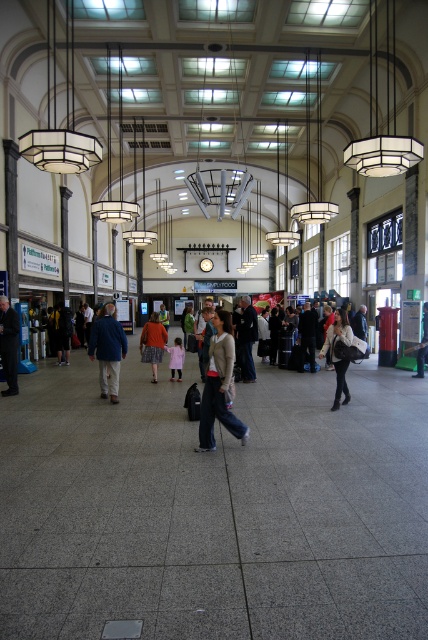
Question: Does matte beige sweater at center have a lesser width compared to dark blue jeans at center?

Choices:
 (A) yes
 (B) no

Answer: (B)

Question: Based on their relative distances, which object is nearer to the dark blue suit at left?

Choices:
 (A) matte beige sweater at center
 (B) dark blue jeans at center
 (C) matte black jacket at center

Answer: (B)

Question: Observing the image, what is the correct spatial positioning of dark blue suit at left in reference to light brown leather jacket at center?

Choices:
 (A) below
 (B) above

Answer: (B)

Question: Estimate the real-world distances between objects in this image. Which object is closer to the dark brown leather jacket at center?

Choices:
 (A) light brown leather jacket at center
 (B) dark blue jeans at center
 (C) dark blue suit at left

Answer: (C)

Question: Which of these objects is positioned farthest from the dark brown leather jacket at center?

Choices:
 (A) dark blue jeans at center
 (B) matte red jacket at center
 (C) blue fabric jacket at center
 (D) matte beige sweater at center

Answer: (D)

Question: Does dark blue suit at left have a smaller size compared to light brown leather jacket at center?

Choices:
 (A) no
 (B) yes

Answer: (B)